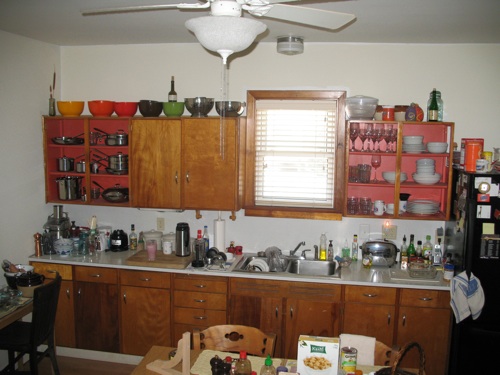
What are the coordinates of `wood cabinets` in the screenshot? It's located at (211, 166), (163, 157), (159, 182), (157, 312), (231, 306), (351, 298), (91, 296).